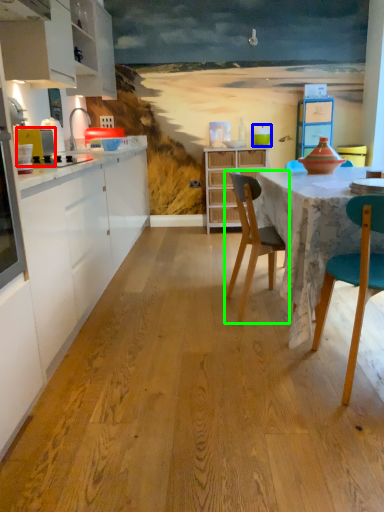
Question: Which object is the closest to the appliance (highlighted by a red box)? Choose among these: teal (highlighted by a blue box) or chair (highlighted by a green box).

Choices:
 (A) teal
 (B) chair

Answer: (B)